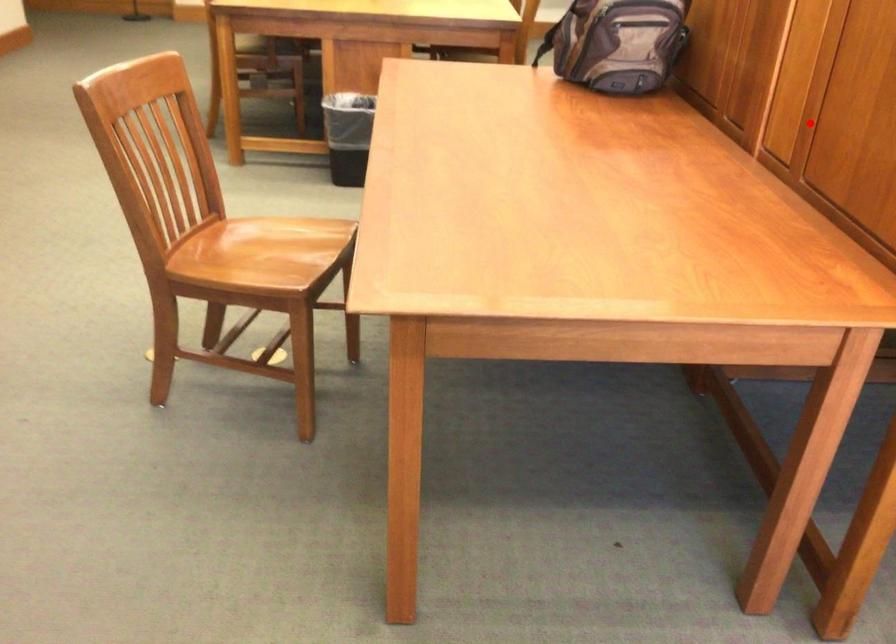
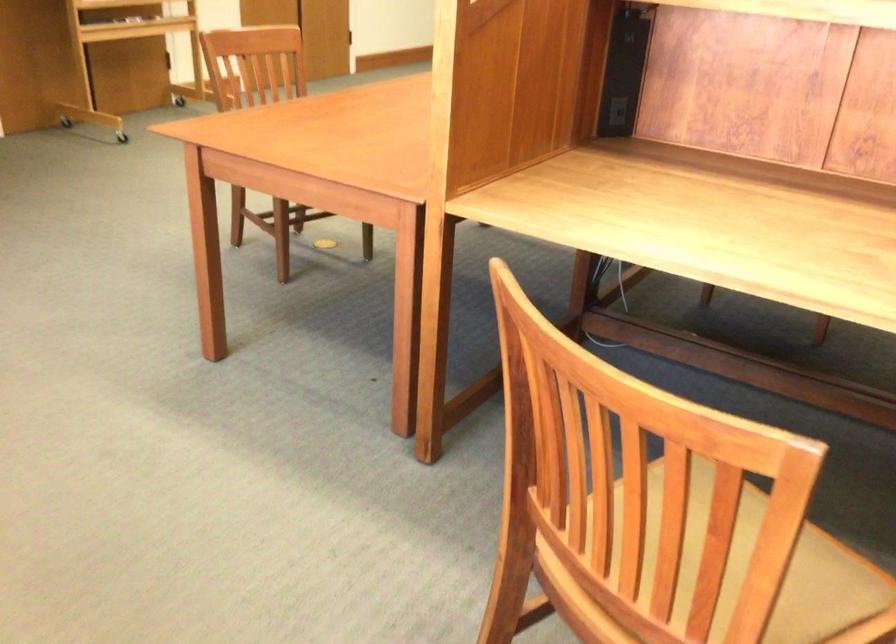
Locate, in the second image, the point that corresponds to the highlighted location in the first image.

(616, 111)